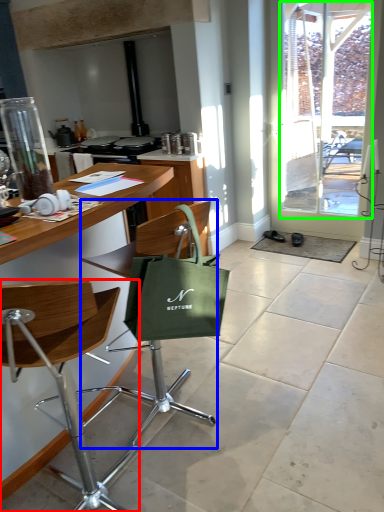
Question: Estimate the real-world distances between objects in this image. Which object is closer to chair (highlighted by a red box), chair (highlighted by a blue box) or window screen (highlighted by a green box)?

Choices:
 (A) chair
 (B) window screen

Answer: (A)